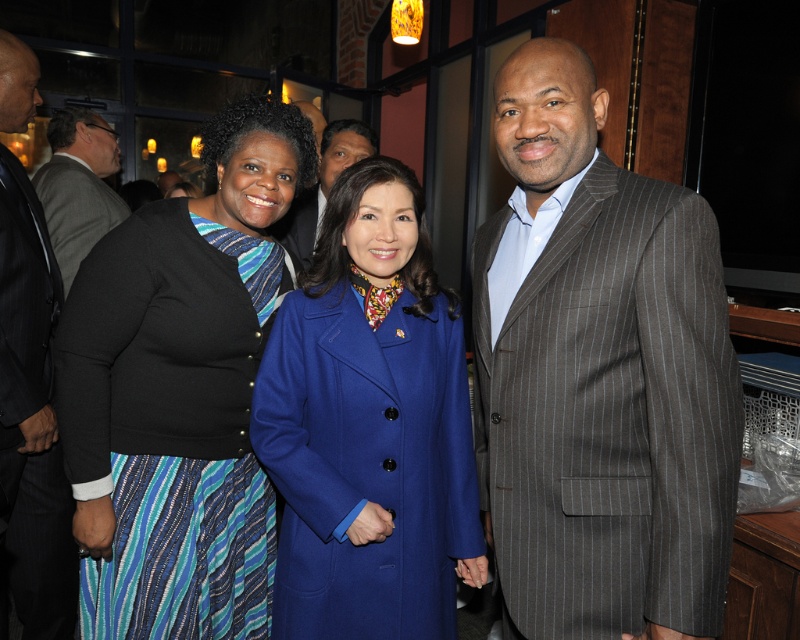
You are a photographer adjusting the lighting for a group photo. You notice the black textured cardigan at left and the dark gray pinstripe suit at left in the frame. Given that the minimum distance required for even lighting between subjects is 45 centimeters, will the current spacing between them suffice?

The black textured cardigan at left and dark gray pinstripe suit at left are 46.71 centimeters apart, which exceeds the minimum required 45 centimeters. Therefore, the current spacing is sufficient for even lighting between them.